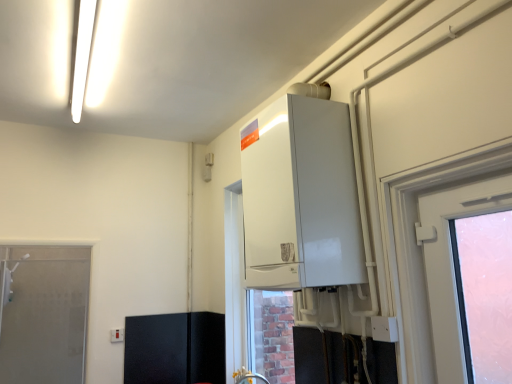
Locate an element on the screen. The height and width of the screenshot is (384, 512). matte silver faucet at lower center is located at coordinates (249, 378).

You are a GUI agent. You are given a task and a screenshot of the screen. Output one action in this format:
    pyautogui.click(x=<x>, y=<y>)
    Task: Click on the matte silver faucet at lower center
    
    Given the screenshot: What is the action you would take?
    pyautogui.click(x=249, y=378)

Does frosted glass door at left appear on the left side of white glossy boiler at upper center?

Yes.

Considering the sizes of objects frosted glass door at left and white glossy boiler at upper center in the image provided, who is bigger, frosted glass door at left or white glossy boiler at upper center?

white glossy boiler at upper center.

Between frosted glass door at left and white glossy boiler at upper center, which one is positioned behind?

Positioned behind is frosted glass door at left.

Does point (3, 247) appear closer or farther from the camera than point (243, 178)?

Clearly, point (3, 247) is more distant from the camera than point (243, 178).

Considering the relative sizes of black leather cabinet at lower left and white glossy boiler at upper center in the image provided, is black leather cabinet at lower left smaller than white glossy boiler at upper center?

Yes, black leather cabinet at lower left is smaller than white glossy boiler at upper center.

Consider the image. From the image's perspective, which object appears higher, black leather cabinet at lower left or white glossy boiler at upper center?

white glossy boiler at upper center appears higher in the image.

At what (x,y) coordinates should I click in order to perform the action: click on cabinetry on the left of white glossy boiler at upper center. Please return your answer as a coordinate pair (x, y). Image resolution: width=512 pixels, height=384 pixels. Looking at the image, I should click on (175, 348).

Is white glossy boiler at upper center turned away from matte silver faucet at lower center?

No, white glossy boiler at upper center is not facing the opposite direction of matte silver faucet at lower center.

In the scene shown: Is white glossy boiler at upper center completely or partially outside of matte silver faucet at lower center?

white glossy boiler at upper center lies outside matte silver faucet at lower center's area.

From the image's perspective, is white glossy boiler at upper center located above matte silver faucet at lower center?

Yes, from the image's perspective, white glossy boiler at upper center is on top of matte silver faucet at lower center.

Between white glossy boiler at upper center and matte silver faucet at lower center, which one has more height?

Standing taller between the two is white glossy boiler at upper center.

Is white glossy boiler at upper center facing towards frosted glass door at left?

No, white glossy boiler at upper center is not facing towards frosted glass door at left.

Image resolution: width=512 pixels, height=384 pixels. I want to click on door located on the left of white glossy boiler at upper center, so click(x=42, y=313).

Is white glossy boiler at upper center inside or outside of frosted glass door at left?

white glossy boiler at upper center is not inside frosted glass door at left, it's outside.

From a real-world perspective, relative to frosted glass door at left, is white glossy boiler at upper center vertically above or below?

white glossy boiler at upper center is above frosted glass door at left.

Considering the relative positions of black leather cabinet at lower left and matte silver faucet at lower center in the image provided, is black leather cabinet at lower left to the left or to the right of matte silver faucet at lower center?

Clearly, black leather cabinet at lower left is on the left of matte silver faucet at lower center in the image.

Identify the location of cabinetry above the matte silver faucet at lower center (from a real-world perspective). The image size is (512, 384). (175, 348).

From the image's perspective, is black leather cabinet at lower left positioned above or below matte silver faucet at lower center?

From the image's perspective, black leather cabinet at lower left appears below matte silver faucet at lower center.

Which of these two, frosted glass door at left or matte silver faucet at lower center, stands shorter?

matte silver faucet at lower center.

Is frosted glass door at left positioned with its back to matte silver faucet at lower center?

No, frosted glass door at left's orientation is not away from matte silver faucet at lower center.

From the image's perspective, is frosted glass door at left above or below matte silver faucet at lower center?

Clearly, from the image's perspective, frosted glass door at left is below matte silver faucet at lower center.

Find the location of `faucet that appears in front of the frosted glass door at left`. faucet that appears in front of the frosted glass door at left is located at coordinates (249, 378).

Find the location of a particular element. The width and height of the screenshot is (512, 384). appliance on the right of the black leather cabinet at lower left is located at coordinates (301, 197).

Which object is closer to the camera taking this photo, white glossy boiler at upper center or black leather cabinet at lower left?

white glossy boiler at upper center.

From a real-world perspective, is white glossy boiler at upper center physically above black leather cabinet at lower left?

Yes, from a real-world perspective, white glossy boiler at upper center is on top of black leather cabinet at lower left.

Is white glossy boiler at upper center to the right of black leather cabinet at lower left from the viewer's perspective?

Correct, you'll find white glossy boiler at upper center to the right of black leather cabinet at lower left.

In order to click on door lying below the white glossy boiler at upper center (from the image's perspective) in this screenshot , I will do click(x=42, y=313).

Where is `cabinetry behind the white glossy boiler at upper center`? cabinetry behind the white glossy boiler at upper center is located at coordinates (175, 348).

Which object lies further to the anchor point matte silver faucet at lower center, black leather cabinet at lower left or frosted glass door at left?

frosted glass door at left lies further to matte silver faucet at lower center than the other object.

When comparing their distances from matte silver faucet at lower center, does frosted glass door at left or white glossy boiler at upper center seem further?

frosted glass door at left is positioned further to the anchor matte silver faucet at lower center.

Based on their spatial positions, is matte silver faucet at lower center or white glossy boiler at upper center further from black leather cabinet at lower left?

white glossy boiler at upper center is further to black leather cabinet at lower left.

Which object lies further to the anchor point black leather cabinet at lower left, frosted glass door at left or white glossy boiler at upper center?

Among the two, white glossy boiler at upper center is located further to black leather cabinet at lower left.

From the picture: Looking at the image, which one is located further to black leather cabinet at lower left, frosted glass door at left or matte silver faucet at lower center?

frosted glass door at left is further to black leather cabinet at lower left.

When comparing their distances from frosted glass door at left, does matte silver faucet at lower center or black leather cabinet at lower left seem further?

matte silver faucet at lower center is positioned further to the anchor frosted glass door at left.

From the image, which object appears to be farther from matte silver faucet at lower center, white glossy boiler at upper center or frosted glass door at left?

frosted glass door at left.

When comparing their distances from matte silver faucet at lower center, does white glossy boiler at upper center or black leather cabinet at lower left seem closer?

Among the two, black leather cabinet at lower left is located nearer to matte silver faucet at lower center.

The width and height of the screenshot is (512, 384). I want to click on cabinetry between frosted glass door at left and matte silver faucet at lower center in the horizontal direction, so 175,348.

Where is `faucet located between white glossy boiler at upper center and black leather cabinet at lower left in the depth direction`? faucet located between white glossy boiler at upper center and black leather cabinet at lower left in the depth direction is located at coordinates (249, 378).

The width and height of the screenshot is (512, 384). What are the coordinates of `faucet between frosted glass door at left and white glossy boiler at upper center in the horizontal direction` in the screenshot? It's located at (249, 378).

I want to click on cabinetry situated between frosted glass door at left and white glossy boiler at upper center from left to right, so click(175, 348).